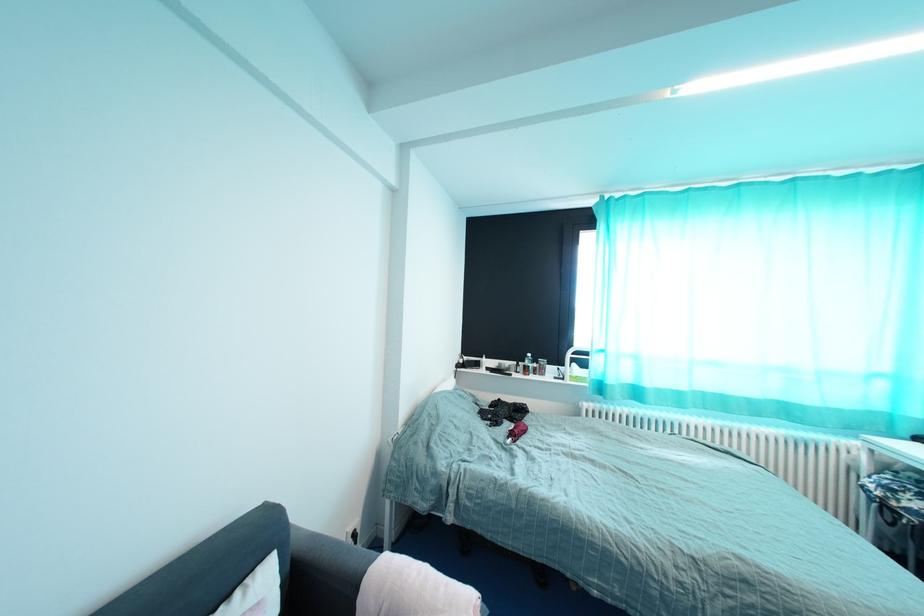
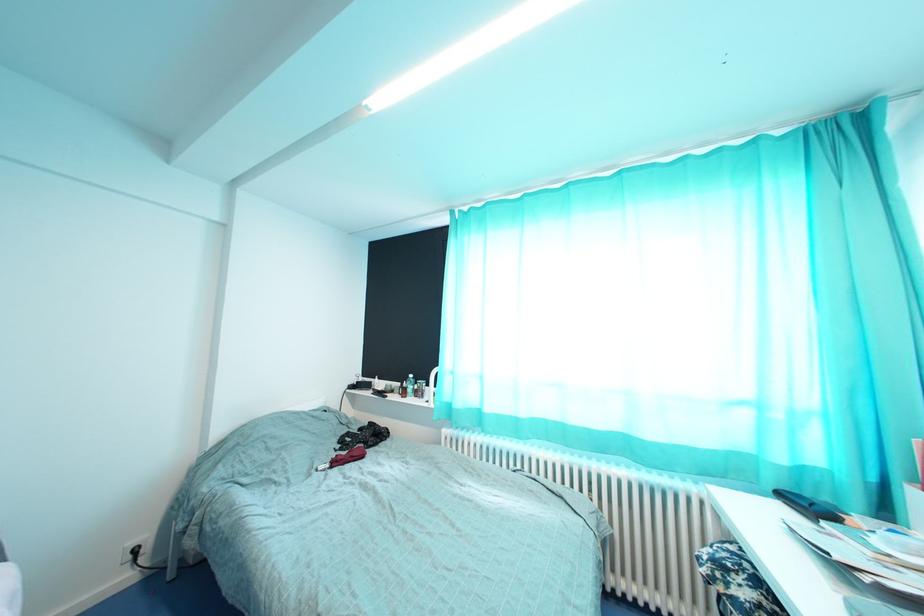
Question: The images are taken continuously from a first-person perspective. In which direction are you moving?

Choices:
 (A) Left
 (B) Right
 (C) Forward
 (D) Backward

Answer: (B)